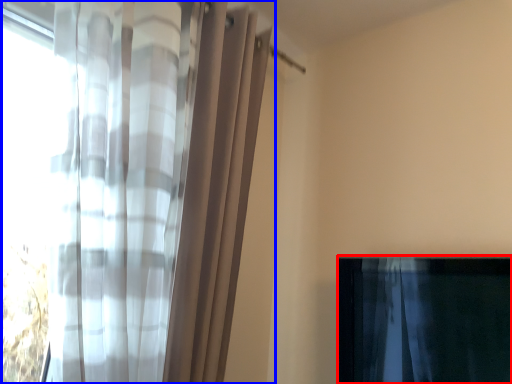
Question: Among these objects, which one is farthest to the camera, curtain (highlighted by a red box) or curtain (highlighted by a blue box)?

Choices:
 (A) curtain
 (B) curtain

Answer: (A)